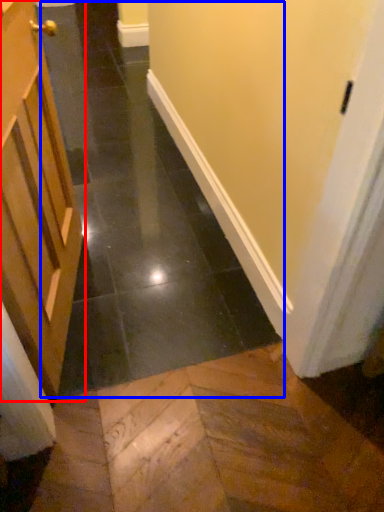
Question: Among these objects, which one is farthest to the camera, door (highlighted by a red box) or path (highlighted by a blue box)?

Choices:
 (A) door
 (B) path

Answer: (A)